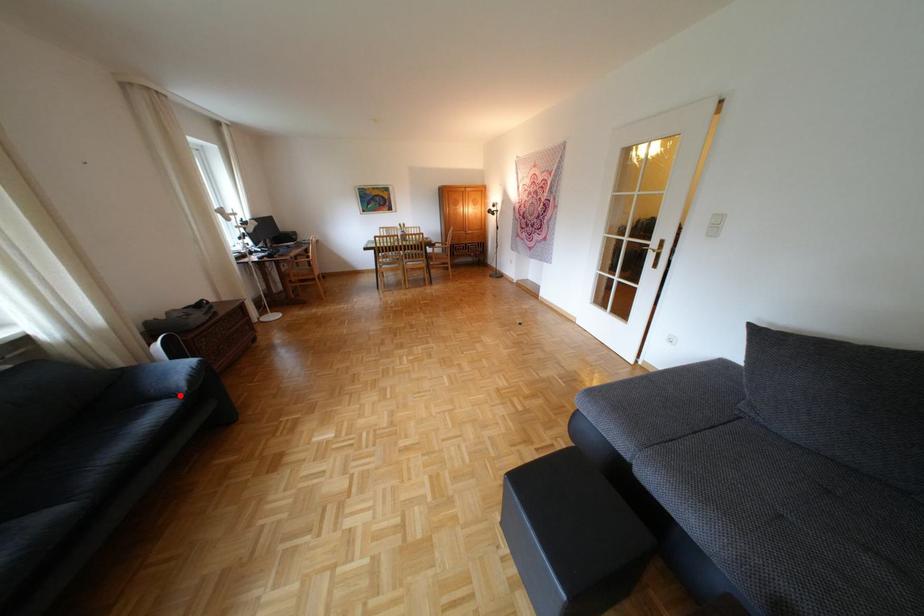
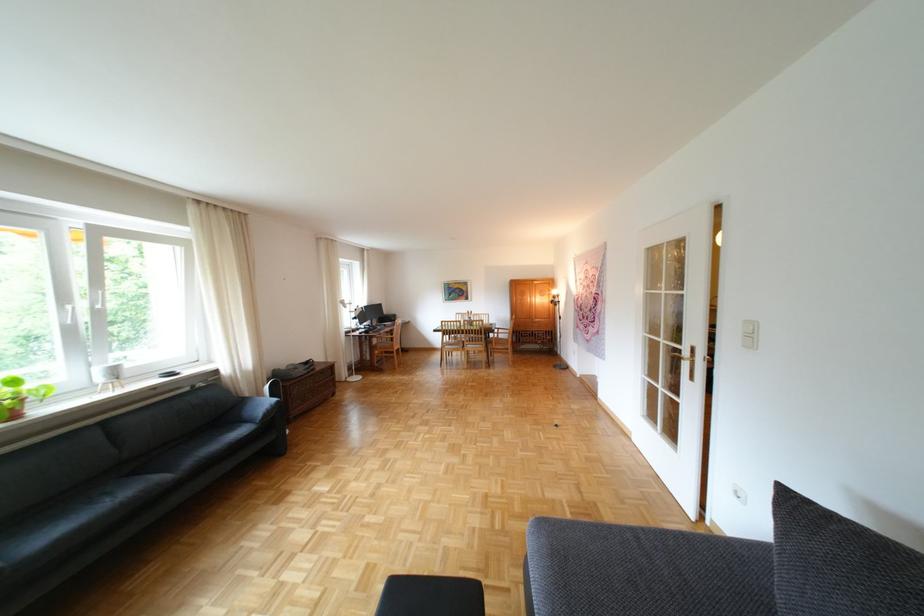
Question: I am providing you with two images of the same scene from different viewpoints. Given a red point in image1, look at the same physical point in image2. Is it:

Choices:
 (A) Closer to the viewpoint
 (B) Farther from the viewpoint

Answer: (A)